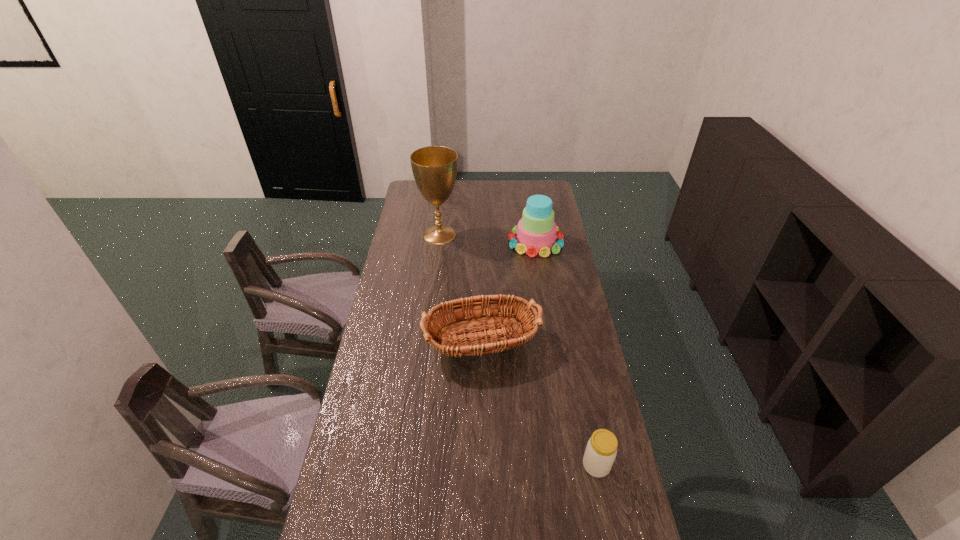
Locate an element on the screen. trophy cup at the left edge is located at coordinates [434, 168].

You are a GUI agent. You are given a task and a screenshot of the screen. Output one action in this format:
    pyautogui.click(x=<x>, y=<y>)
    Task: Click on the basket situated at the left edge
    This screenshot has height=540, width=960.
    Given the screenshot: What is the action you would take?
    pyautogui.click(x=480, y=342)

Identify the location of cake situated at the right edge. Image resolution: width=960 pixels, height=540 pixels. (536, 232).

In order to click on basket that is at the right edge in this screenshot , I will do `click(480, 342)`.

I want to click on jar that is at the right edge, so click(601, 450).

Where is `vacant region at the left edge of the desktop`? vacant region at the left edge of the desktop is located at coordinates (414, 224).

The width and height of the screenshot is (960, 540). In the image, there is a desktop. In order to click on free space at the right edge in this screenshot , I will do `click(565, 350)`.

Locate an element on the screen. vacant space at the far left corner is located at coordinates (408, 195).

You are a GUI agent. You are given a task and a screenshot of the screen. Output one action in this format:
    pyautogui.click(x=<x>, y=<y>)
    Task: Click on the vacant space that's between the basket and the tallest object
    This screenshot has width=960, height=540.
    Given the screenshot: What is the action you would take?
    pyautogui.click(x=458, y=288)

Identify the location of empty space between the third tallest object and the trophy cup. This screenshot has height=540, width=960. (458, 288).